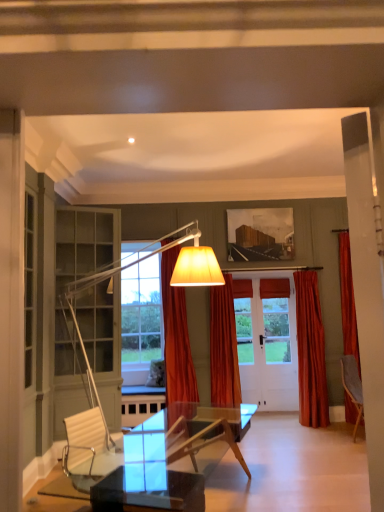
Measure the distance between point (x=178, y=310) and camera.

The distance of point (x=178, y=310) from camera is 4.62 meters.

At what (x,y) coordinates should I click in order to perform the action: click on velvet orange curtain at right, the 1th curtain viewed from the right. Please return your answer as a coordinate pair (x, y). Looking at the image, I should click on (310, 352).

This screenshot has width=384, height=512. What are the coordinates of `the 1st curtain to the right of the orange velvet curtain at center, the first curtain from the left, counting from the anchor's position` in the screenshot? It's located at (224, 347).

Is orange velvet curtain at center, marked as the third curtain in a right-to-left arrangement, in front of or behind orange velvet curtain at center, the second curtain when ordered from right to left, in the image?

orange velvet curtain at center, marked as the third curtain in a right-to-left arrangement, is positioned closer to the viewer than orange velvet curtain at center, the second curtain when ordered from right to left.

Is orange velvet curtain at center, marked as the third curtain in a right-to-left arrangement, oriented away from orange velvet curtain at center, which ranks as the second curtain in left-to-right order?

No, orange velvet curtain at center, marked as the third curtain in a right-to-left arrangement,'s orientation is not away from orange velvet curtain at center, which ranks as the second curtain in left-to-right order.

From the image's perspective, does velvet orange curtain at right, the 3th curtain positioned from the left, appear lower than orange velvet curtain at center, which ranks as the second curtain in left-to-right order?

Yes, from the image's perspective, velvet orange curtain at right, the 3th curtain positioned from the left, is below orange velvet curtain at center, which ranks as the second curtain in left-to-right order.

Does velvet orange curtain at right, the 3th curtain positioned from the left, lie in front of orange velvet curtain at center, which ranks as the second curtain in left-to-right order?

That is False.

Which curtain is the 1st one when counting from the front of the velvet orange curtain at right, the 1th curtain viewed from the right? Please provide its 2D coordinates.

[(224, 347)]

Which object is further away from the camera taking this photo, orange velvet curtain at center, the first curtain from the left, or velvet orange curtain at right, the 3th curtain positioned from the left?

Positioned behind is velvet orange curtain at right, the 3th curtain positioned from the left.

Based on their sizes in the image, would you say orange velvet curtain at center, the first curtain from the left, is bigger or smaller than velvet orange curtain at right, the 3th curtain positioned from the left?

Clearly, orange velvet curtain at center, the first curtain from the left, is larger in size than velvet orange curtain at right, the 3th curtain positioned from the left.

From the image's perspective, is orange velvet curtain at center, marked as the third curtain in a right-to-left arrangement, positioned above or below velvet orange curtain at right, the 1th curtain viewed from the right?

Clearly, from the image's perspective, orange velvet curtain at center, marked as the third curtain in a right-to-left arrangement, is above velvet orange curtain at right, the 1th curtain viewed from the right.

Is orange velvet curtain at center, the first curtain from the left, not near velvet orange curtain at right, the 3th curtain positioned from the left?

Yes, orange velvet curtain at center, the first curtain from the left, and velvet orange curtain at right, the 3th curtain positioned from the left, are located far from each other.

Would you say orange velvet curtain at center, the second curtain when ordered from right to left, is a long distance from orange velvet curtain at center, marked as the third curtain in a right-to-left arrangement?

No, orange velvet curtain at center, the second curtain when ordered from right to left, is not far from orange velvet curtain at center, marked as the third curtain in a right-to-left arrangement.

Would you say orange velvet curtain at center, the second curtain when ordered from right to left, is outside orange velvet curtain at center, the first curtain from the left?

That's correct, orange velvet curtain at center, the second curtain when ordered from right to left, is outside of orange velvet curtain at center, the first curtain from the left.

Consider the image. Which point is more forward, (218, 336) or (179, 251)?

The point (179, 251) is closer.

Considering the relative sizes of orange velvet curtain at center, the second curtain when ordered from right to left, and orange velvet curtain at center, the first curtain from the left, in the image provided, is orange velvet curtain at center, the second curtain when ordered from right to left, smaller than orange velvet curtain at center, the first curtain from the left,?

Indeed, orange velvet curtain at center, the second curtain when ordered from right to left, has a smaller size compared to orange velvet curtain at center, the first curtain from the left.

Is velvet orange curtain at right, the 1th curtain viewed from the right, in front of orange velvet curtain at center, the first curtain from the left?

No, it is not.

Is velvet orange curtain at right, the 1th curtain viewed from the right, looking in the opposite direction of orange velvet curtain at center, marked as the third curtain in a right-to-left arrangement?

No, velvet orange curtain at right, the 1th curtain viewed from the right, is not facing the opposite direction of orange velvet curtain at center, marked as the third curtain in a right-to-left arrangement.

In order to click on curtain that is the 2nd object directly below the orange velvet curtain at center, the first curtain from the left (from a real-world perspective) in this screenshot , I will do `click(310, 352)`.

From a real-world perspective, between velvet orange curtain at right, the 1th curtain viewed from the right, and orange velvet curtain at center, the first curtain from the left, who is vertically higher?

From a 3D spatial view, orange velvet curtain at center, the first curtain from the left, is above.

Could you tell me if orange velvet curtain at center, which ranks as the second curtain in left-to-right order, is turned towards velvet orange curtain at right, the 3th curtain positioned from the left?

No, orange velvet curtain at center, which ranks as the second curtain in left-to-right order, is not aimed at velvet orange curtain at right, the 3th curtain positioned from the left.

In the scene shown: Does orange velvet curtain at center, the second curtain when ordered from right to left, have a greater width compared to velvet orange curtain at right, the 3th curtain positioned from the left?

Indeed, orange velvet curtain at center, the second curtain when ordered from right to left, has a greater width compared to velvet orange curtain at right, the 3th curtain positioned from the left.

Which object is positioned more to the left, orange velvet curtain at center, which ranks as the second curtain in left-to-right order, or velvet orange curtain at right, the 1th curtain viewed from the right?

orange velvet curtain at center, which ranks as the second curtain in left-to-right order, is more to the left.

Would you say orange velvet curtain at center, the second curtain when ordered from right to left, contains velvet orange curtain at right, the 1th curtain viewed from the right?

Definitely not — velvet orange curtain at right, the 1th curtain viewed from the right, is not inside orange velvet curtain at center, the second curtain when ordered from right to left.

Where is `curtain located in front of the orange velvet curtain at center, the second curtain when ordered from right to left`? Image resolution: width=384 pixels, height=512 pixels. curtain located in front of the orange velvet curtain at center, the second curtain when ordered from right to left is located at coordinates (176, 337).

The image size is (384, 512). Identify the location of curtain below the orange velvet curtain at center, the second curtain when ordered from right to left (from a real-world perspective). (310, 352).

Considering their positions, is orange velvet curtain at center, marked as the third curtain in a right-to-left arrangement, positioned closer to orange velvet curtain at center, the second curtain when ordered from right to left, than velvet orange curtain at right, the 3th curtain positioned from the left?

Among the two, orange velvet curtain at center, marked as the third curtain in a right-to-left arrangement, is located nearer to orange velvet curtain at center, the second curtain when ordered from right to left.

From the image, which object appears to be nearer to orange velvet curtain at center, the second curtain when ordered from right to left, velvet orange curtain at right, the 1th curtain viewed from the right, or orange velvet curtain at center, the first curtain from the left?

Among the two, orange velvet curtain at center, the first curtain from the left, is located nearer to orange velvet curtain at center, the second curtain when ordered from right to left.

Based on their spatial positions, is orange velvet curtain at center, the first curtain from the left, or orange velvet curtain at center, the second curtain when ordered from right to left, closer to velvet orange curtain at right, the 3th curtain positioned from the left?

The object closer to velvet orange curtain at right, the 3th curtain positioned from the left, is orange velvet curtain at center, the second curtain when ordered from right to left.

Considering their positions, is orange velvet curtain at center, the second curtain when ordered from right to left, positioned closer to velvet orange curtain at right, the 3th curtain positioned from the left, than orange velvet curtain at center, the first curtain from the left?

orange velvet curtain at center, the second curtain when ordered from right to left, is positioned closer to the anchor velvet orange curtain at right, the 3th curtain positioned from the left.

Estimate the real-world distances between objects in this image. Which object is further from orange velvet curtain at center, the first curtain from the left, velvet orange curtain at right, the 3th curtain positioned from the left, or orange velvet curtain at center, which ranks as the second curtain in left-to-right order?

Based on the image, velvet orange curtain at right, the 3th curtain positioned from the left, appears to be further to orange velvet curtain at center, the first curtain from the left.

Which object lies further to the anchor point orange velvet curtain at center, marked as the third curtain in a right-to-left arrangement, orange velvet curtain at center, which ranks as the second curtain in left-to-right order, or velvet orange curtain at right, the 3th curtain positioned from the left?

Among the two, velvet orange curtain at right, the 3th curtain positioned from the left, is located further to orange velvet curtain at center, marked as the third curtain in a right-to-left arrangement.

This screenshot has width=384, height=512. I want to click on curtain between orange velvet curtain at center, the first curtain from the left, and velvet orange curtain at right, the 1th curtain viewed from the right, so click(224, 347).